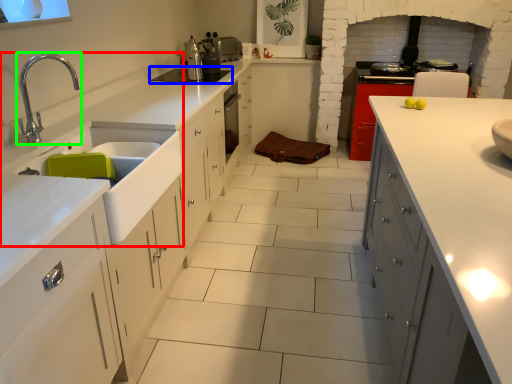
Question: Considering the real-world distances, which object is farthest from sink (highlighted by a red box)? home appliance (highlighted by a blue box) or tap (highlighted by a green box)?

Choices:
 (A) home appliance
 (B) tap

Answer: (A)